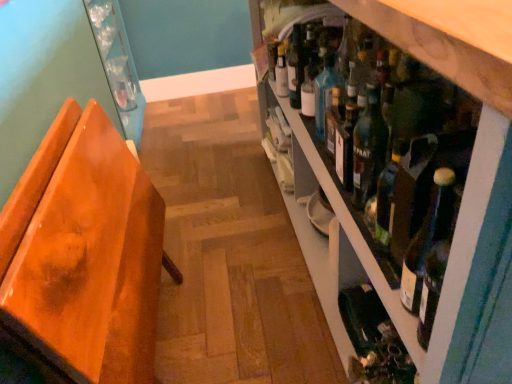
Question: From a real-world perspective, is white glass bottle at upper center above or below orange wood chair at left?

Choices:
 (A) above
 (B) below

Answer: (A)

Question: From the image's perspective, is white glass bottle at upper center located above or below orange wood chair at left?

Choices:
 (A) below
 (B) above

Answer: (B)

Question: Considering the real-world distances, which object is farthest from the green glass bottle at lower right?

Choices:
 (A) green glass bottle at center right
 (B) white glass bottle at upper center
 (C) green glass bottles at right
 (D) orange wood chair at left
 (E) teal glass bottle at shelf center

Answer: (B)

Question: Estimate the real-world distances between objects in this image. Which object is closer to the green glass bottle at center right?

Choices:
 (A) teal glass bottle at shelf center
 (B) green glass bottle at lower right
 (C) green glass bottles at right
 (D) white glass bottle at upper center
 (E) orange wood chair at left

Answer: (C)